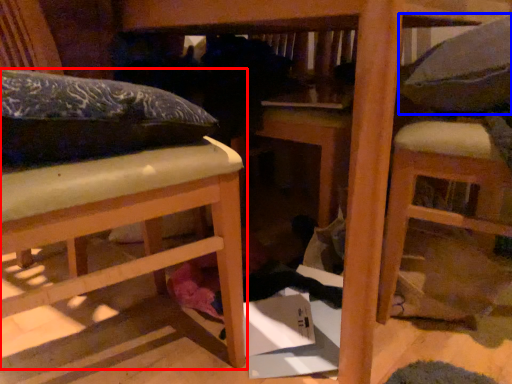
Question: Which object is further to the camera taking this photo, furniture (highlighted by a red box) or pillow (highlighted by a blue box)?

Choices:
 (A) furniture
 (B) pillow

Answer: (B)